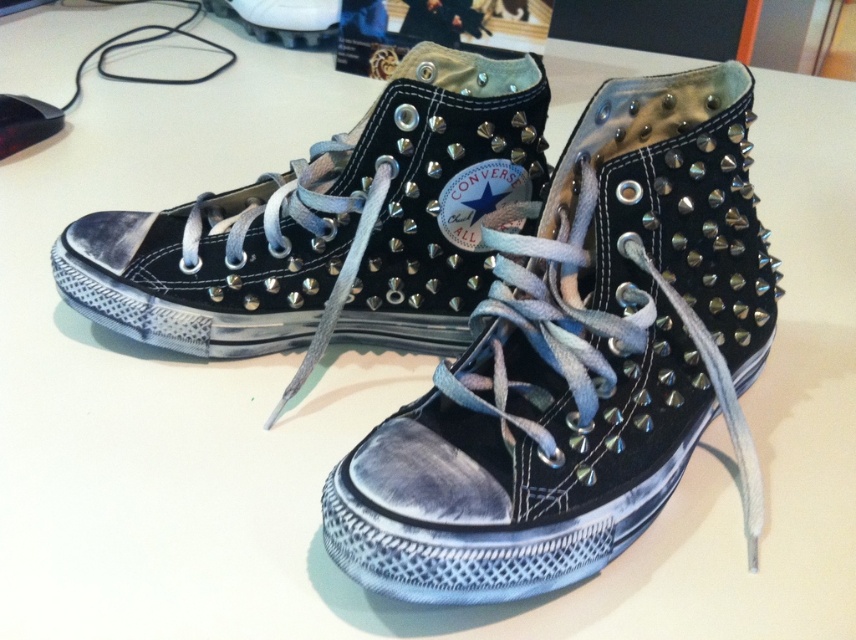
Which of these two, black leather converse at center or matte black sneakers at center, stands shorter?

matte black sneakers at center

Who is higher up, black leather converse at center or matte black sneakers at center?

Positioned higher is matte black sneakers at center.

Describe the element at coordinates (580, 362) in the screenshot. I see `black leather converse at center` at that location.

Image resolution: width=856 pixels, height=640 pixels. Identify the location of black leather converse at center. (580, 362).